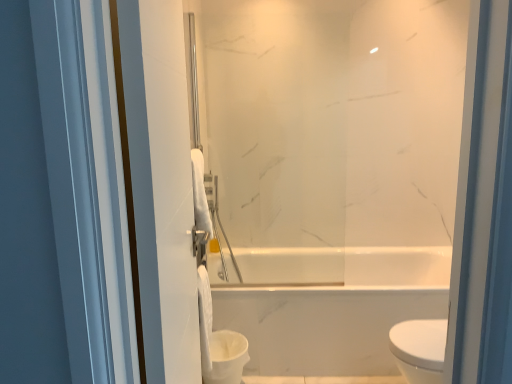
Question: Considering the relative positions of white matte toilet paper at center and white plastic toilet bowl at lower left in the image provided, is white matte toilet paper at center to the left or to the right of white plastic toilet bowl at lower left?

Choices:
 (A) right
 (B) left

Answer: (B)

Question: Would you say white matte toilet paper at center is inside or outside white plastic toilet bowl at lower left?

Choices:
 (A) inside
 (B) outside

Answer: (B)

Question: Which is farther from the white glossy towel at left?

Choices:
 (A) white plastic toilet bowl at lower left
 (B) white matte toilet paper at center

Answer: (A)

Question: Which is nearer to the white matte toilet paper at center?

Choices:
 (A) white plastic toilet bowl at lower left
 (B) white glossy towel at left

Answer: (A)